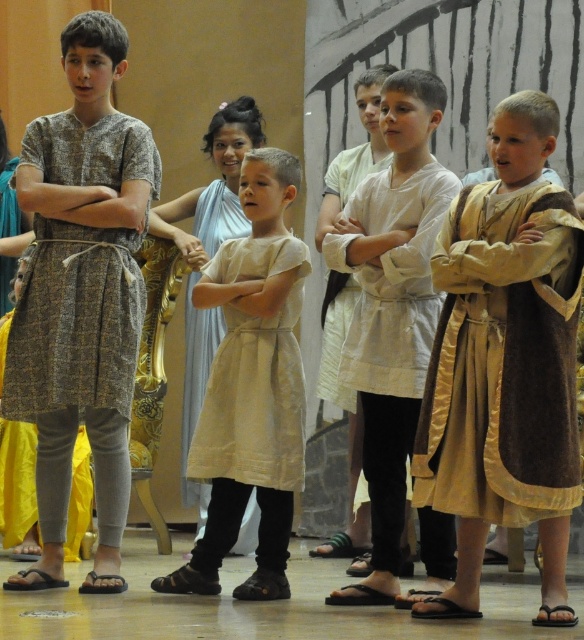
You are a photographer standing in front of the children. You need to take a photo that includes both the white cotton tunic at center and the beige cotton dress at center. Which one should you focus on first to ensure both are in focus?

You should focus on the white cotton tunic at center first because it is closer to the viewer than the beige cotton dress at center, so focusing on it will ensure the beige cotton dress at center also comes into focus.

You are organizing a costume parade and need to arrange the white cotton tunic at center and the beige cotton dress at center side by side. Based on their widths, which costume should be placed on the left to ensure they both fit within the 2.5 meter wide stage?

The white cotton tunic at center is wider than the beige cotton dress at center, so placing the beige cotton dress at center on the left and the white cotton tunic at center on the right would allow both to fit within the 2.5 meter stage.

You are a photographer setting up for a school play. You need to decide which dress to use for the main character. Both the beige fabric dress at center and the beige cotton dress at center are available. Based on their width, which one should you choose if you want a wider dress for the main character?

The beige fabric dress at center is wider than the beige cotton dress at center, so you should choose the beige fabric dress at center for the main character if you want a wider dress.